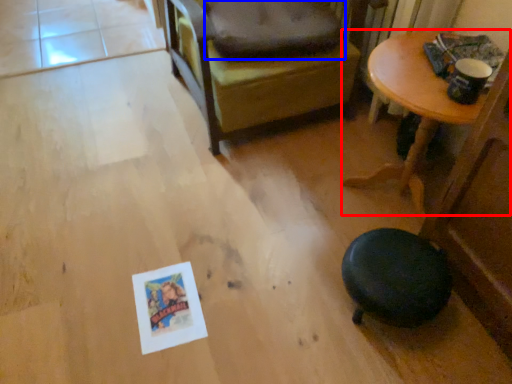
Question: Among these objects, which one is nearest to the camera, table (highlighted by a red box) or dog bed (highlighted by a blue box)?

Choices:
 (A) table
 (B) dog bed

Answer: (A)